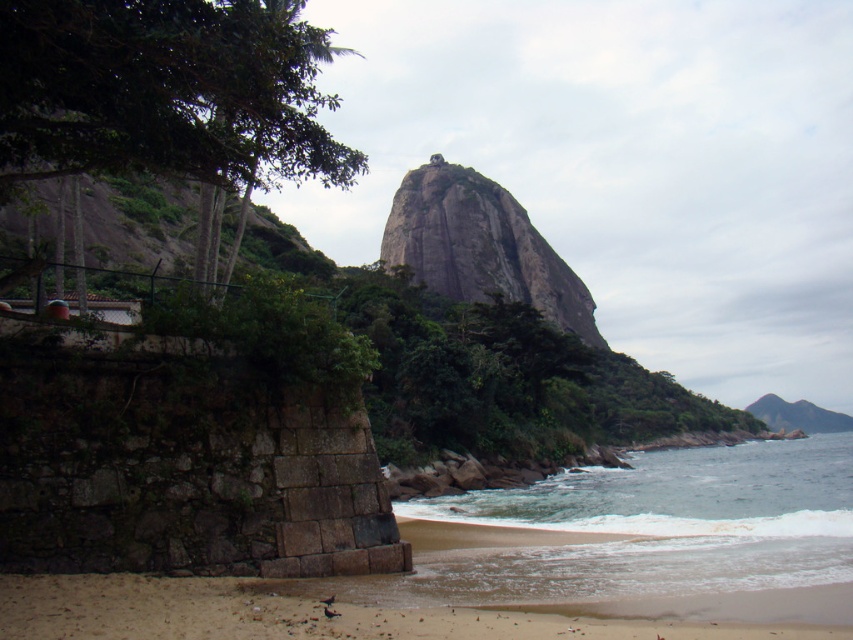
You are standing on the beach looking at the coastal scene. There are two points marked on the image. One is at coordinates point (564, 589) and the other is at point (103, 584). Which point is closer to you?

Point (103, 584) is closer to you because it is less further than point (564, 589).

You are standing at the camera position and want to reach the point marked as point (781, 627). Can you estimate how far you need to walk to reach it?

The point (781, 627) is 9.73 meters away from the camera, so you need to walk approximately 9.73 meters to reach it.